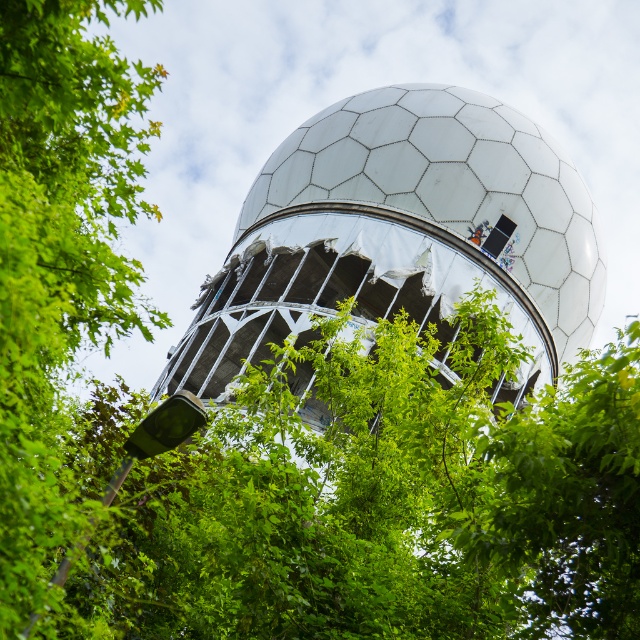
Between white hexagonal dome at center and green leafy tree at center, which one appears on the left side from the viewer's perspective?

From the viewer's perspective, white hexagonal dome at center appears more on the left side.

This screenshot has width=640, height=640. In order to click on white hexagonal dome at center in this screenshot , I will do `click(401, 230)`.

Who is positioned more to the left, green leafy tree at upper left or green leafy tree at center?

Positioned to the left is green leafy tree at upper left.

Does point (17, 307) come closer to viewer compared to point (630, 465)?

No, (17, 307) is further to viewer.

Is point (8, 444) closer to viewer compared to point (540, 624)?

Yes, point (8, 444) is in front of point (540, 624).

You are a GUI agent. You are given a task and a screenshot of the screen. Output one action in this format:
    pyautogui.click(x=<x>, y=<y>)
    Task: Click on the green leafy tree at upper left
    The image size is (640, 640).
    Given the screenshot: What is the action you would take?
    pyautogui.click(x=60, y=256)

Based on the photo, how distant is white hexagonal dome at center from green leafy tree at upper left?

white hexagonal dome at center is 23.95 meters from green leafy tree at upper left.

Can you confirm if white hexagonal dome at center is positioned above green leafy tree at upper left?

Actually, white hexagonal dome at center is below green leafy tree at upper left.

Between point (320, 224) and point (83, 19), which one is positioned behind?

Positioned behind is point (320, 224).

At what (x,y) coordinates should I click in order to perform the action: click on white hexagonal dome at center. Please return your answer as a coordinate pair (x, y). This screenshot has height=640, width=640. Looking at the image, I should click on (401, 230).